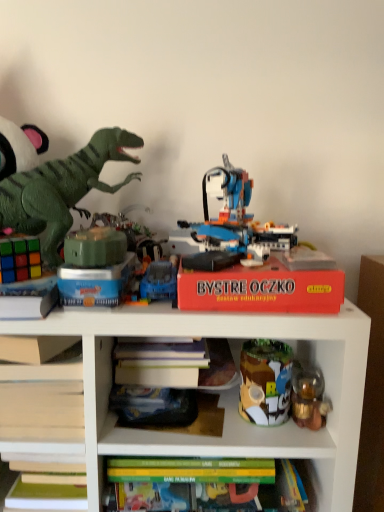
Question: Is gold metallic lantern at right, the 7th toy from the left, to the left or to the right of red cardboard box at upper center in the image?

Choices:
 (A) left
 (B) right

Answer: (B)

Question: Relative to red cardboard box at upper center, is gold metallic lantern at right, the 7th toy from the left, in front or behind?

Choices:
 (A) behind
 (B) front

Answer: (A)

Question: Based on their relative distances, which object is farther from the red cardboard box at upper center?

Choices:
 (A) metallic tin can at center right, the 2th toy when ordered from right to left
 (B) blue plastic toy car at center, acting as the fourth toy starting from the left
 (C) translucent plastic robot at center, arranged as the third toy when viewed from the right
 (D) gold metallic lantern at right, marked as the first toy in a right-to-left arrangement
 (E) red matte board game at center

Answer: (C)

Question: Which is farther from the green plastic dinosaur at left, marked as the second toy in a left-to-right arrangement?

Choices:
 (A) blue plastic toy car at center, arranged as the 4th toy when viewed from the right
 (B) green matte cube at center, placed as the third toy when sorted from left to right
 (C) red matte board game at center
 (D) translucent plastic robot at center, arranged as the third toy when viewed from the right
 (E) gold metallic lantern at right, marked as the first toy in a right-to-left arrangement

Answer: (E)